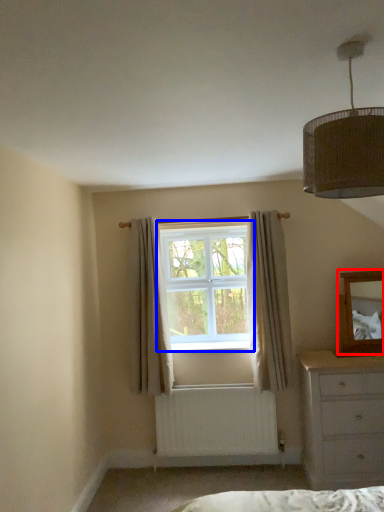
Question: Among these objects, which one is nearest to the camera, mirror (highlighted by a red box) or window (highlighted by a blue box)?

Choices:
 (A) mirror
 (B) window

Answer: (A)